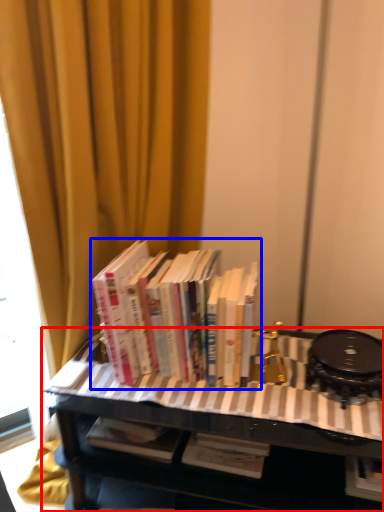
Question: Which object is further to the camera taking this photo, table (highlighted by a red box) or book (highlighted by a blue box)?

Choices:
 (A) table
 (B) book

Answer: (B)